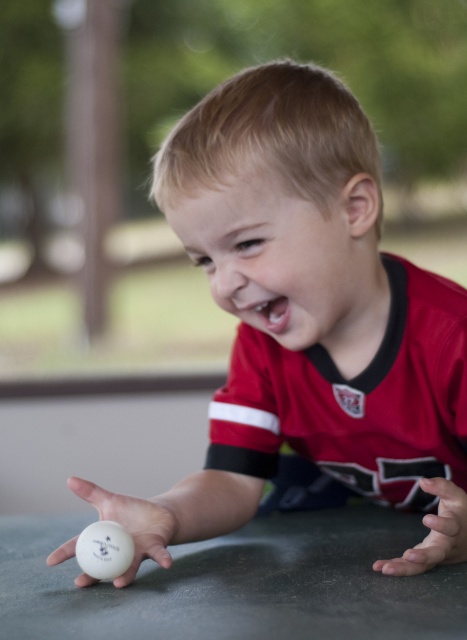
You are a parent observing your child playing with a white matte ping pong ball at lower left and a smooth skin hand at lower right. Which object is closer to the left edge of the table?

The white matte ping pong ball at lower left is closer to the left edge of the table because it is positioned on the left side of the smooth skin hand at lower right.

You are a parent watching your child play. The child is reaching for the white matte ping pong ball at center with their smooth skin hand at lower right. Can the child touch the ball with their hand?

The white matte ping pong ball at center is located above the smooth skin hand at lower right, so the child can reach up to touch the ball with their hand.

The child is reaching for the white matte ping pong ball at center. According to the coordinates provided, is the ball to the left or right of the point (134, 522)?

The white matte ping pong ball at center is exactly at the point (134, 522), so it is neither to the left nor right of that coordinate.